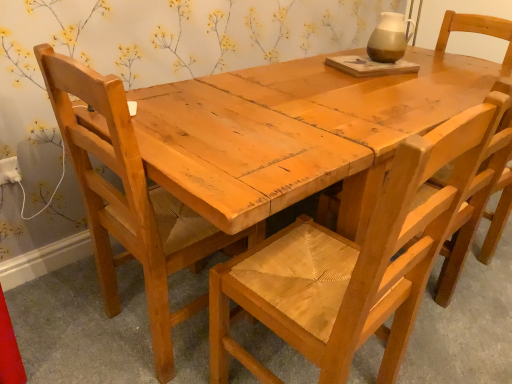
Question: Is natural wood chair at center, placed as the second chair when sorted from right to left, smaller than wooden woven seat at center, marked as the 1th chair in a right-to-left arrangement?

Choices:
 (A) no
 (B) yes

Answer: (A)

Question: From a real-world perspective, is natural wood chair at center, which is counted as the 2th chair, starting from the left, on wooden woven seat at center, which is counted as the 3th chair, starting from the left?

Choices:
 (A) no
 (B) yes

Answer: (B)

Question: Does natural wood chair at center, placed as the second chair when sorted from right to left, have a greater height compared to wooden woven seat at center, which is counted as the 3th chair, starting from the left?

Choices:
 (A) no
 (B) yes

Answer: (B)

Question: Is natural wood chair at center, placed as the second chair when sorted from right to left, shorter than wooden woven seat at center, marked as the 1th chair in a right-to-left arrangement?

Choices:
 (A) yes
 (B) no

Answer: (B)

Question: Does natural wood chair at center, which is counted as the 2th chair, starting from the left, have a lesser width compared to wooden woven seat at center, which is counted as the 3th chair, starting from the left?

Choices:
 (A) no
 (B) yes

Answer: (B)

Question: Considering the positions of point (449, 296) and point (10, 180), is point (449, 296) closer or farther from the camera than point (10, 180)?

Choices:
 (A) closer
 (B) farther

Answer: (B)

Question: Would you say wooden woven seat at center, marked as the 1th chair in a right-to-left arrangement, is to the left or to the right of white plastic electric outlet at lower left in the picture?

Choices:
 (A) right
 (B) left

Answer: (A)

Question: Considering the positions of wooden woven seat at center, marked as the 1th chair in a right-to-left arrangement, and white plastic electric outlet at lower left in the image, is wooden woven seat at center, marked as the 1th chair in a right-to-left arrangement, bigger or smaller than white plastic electric outlet at lower left?

Choices:
 (A) big
 (B) small

Answer: (A)

Question: Considering their positions, is wooden woven seat at center, marked as the 1th chair in a right-to-left arrangement, located in front of or behind white plastic electric outlet at lower left?

Choices:
 (A) behind
 (B) front

Answer: (B)

Question: Does point 476,157 appear closer or farther from the camera than point 495,147?

Choices:
 (A) farther
 (B) closer

Answer: (B)

Question: In the image, is natural wood chair at center, placed as the second chair when sorted from right to left, positioned in front of or behind wooden woven seat at center, which is counted as the 3th chair, starting from the left?

Choices:
 (A) front
 (B) behind

Answer: (A)

Question: Is natural wood chair at center, placed as the second chair when sorted from right to left, to the left or to the right of wooden woven seat at center, which is counted as the 3th chair, starting from the left, in the image?

Choices:
 (A) right
 (B) left

Answer: (B)

Question: Considering the positions of natural wood chair at center, which is counted as the 2th chair, starting from the left, and wooden woven seat at center, which is counted as the 3th chair, starting from the left, in the image, is natural wood chair at center, which is counted as the 2th chair, starting from the left, wider or thinner than wooden woven seat at center, which is counted as the 3th chair, starting from the left,?

Choices:
 (A) wide
 (B) thin

Answer: (B)

Question: From the image's perspective, is natural wood chair at left, marked as the 1th chair in a left-to-right arrangement, above or below white plastic electric outlet at lower left?

Choices:
 (A) above
 (B) below

Answer: (B)

Question: Visually, is natural wood chair at left, marked as the third chair in a right-to-left arrangement, positioned to the left or to the right of white plastic electric outlet at lower left?

Choices:
 (A) right
 (B) left

Answer: (A)